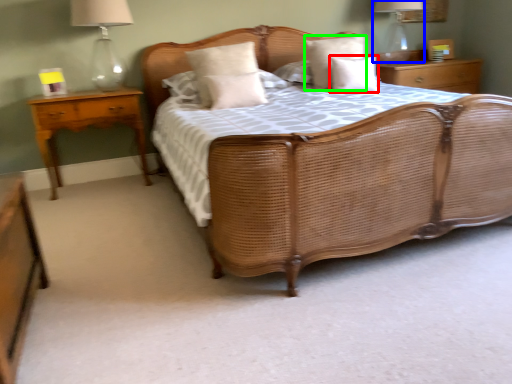
Question: Estimate the real-world distances between objects in this image. Which object is closer to pillow (highlighted by a red box), bedside lamp (highlighted by a blue box) or pillow (highlighted by a green box)?

Choices:
 (A) bedside lamp
 (B) pillow

Answer: (B)